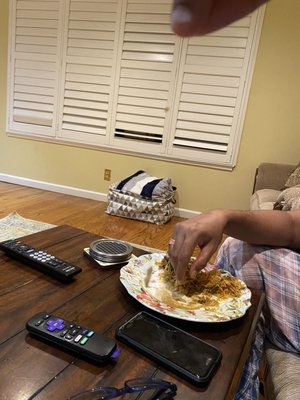
You are a GUI agent. You are given a task and a screenshot of the screen. Output one action in this format:
    pyautogui.click(x=<x>, y=<y>)
    Task: Click on the phone
    The height and width of the screenshot is (400, 300).
    Given the screenshot: What is the action you would take?
    pyautogui.click(x=175, y=348)